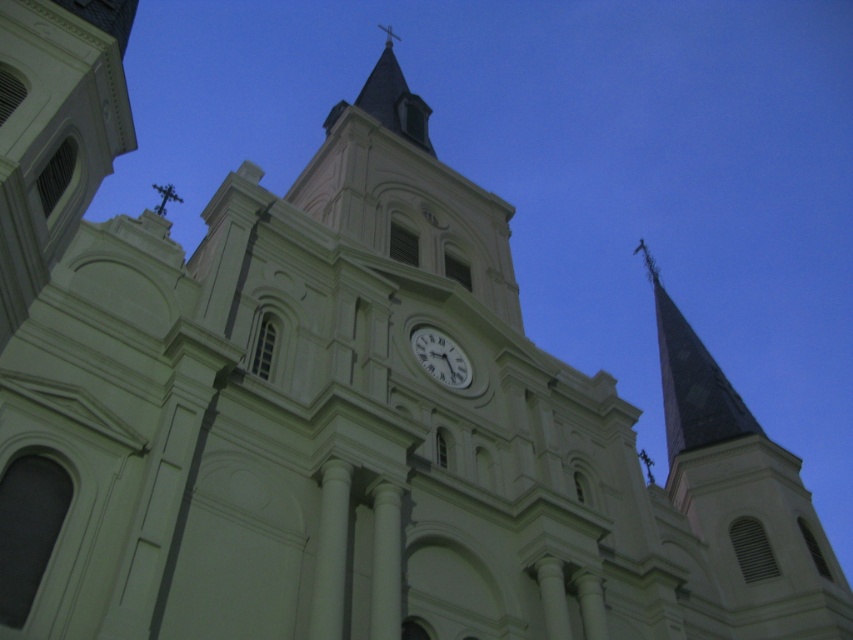
You are an architect examining the church facade. You notice the dark gray slate spire at upper right and the white glossy clock at center. Which object is located to the right of the other?

The dark gray slate spire at upper right is positioned on the right side of white glossy clock at center.

You are standing in front of the church and want to locate the smooth gray steeple at right and the dark gray slate spire at upper right. Based on their positions, which one is positioned to the left of the other?

The smooth gray steeple at right is positioned to the left of the dark gray slate spire at upper right.

You are standing in front of the church and want to take a photo of the white glossy clock at center and the smooth gray steeple at right. Based on their positions, which object should you frame first in your camera viewfinder to ensure both are captured in the same shot?

The smooth gray steeple at right is to the right of the white glossy clock at center, so you should frame the white glossy clock at center first and pan slightly to the right to include the smooth gray steeple at right in the same shot.